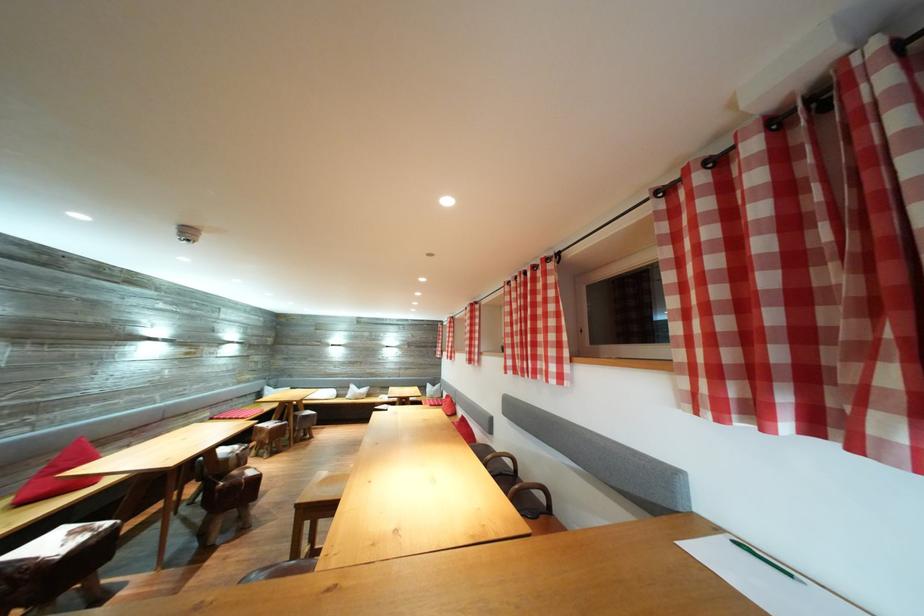
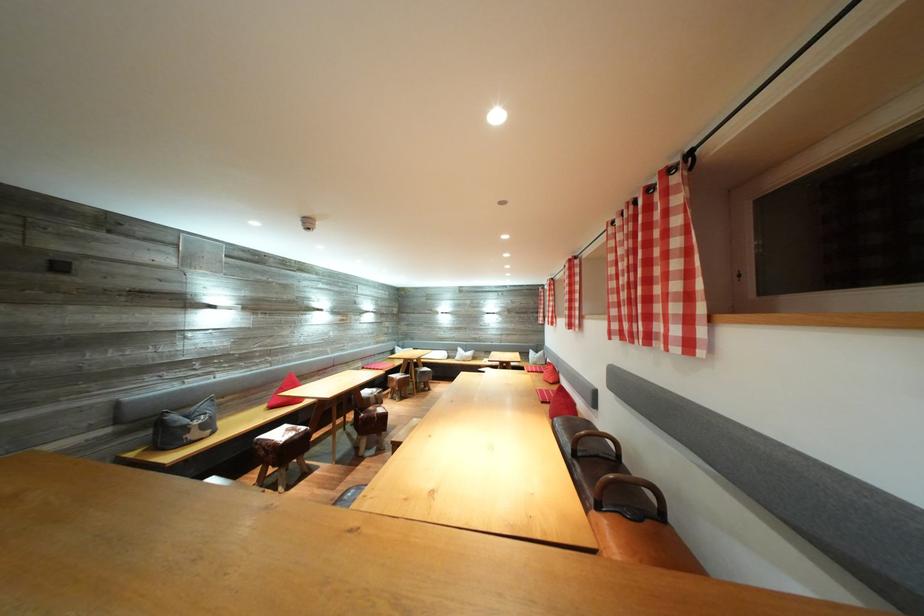
In the second image, find the point that corresponds to pixel 549 523 in the first image.

(655, 529)